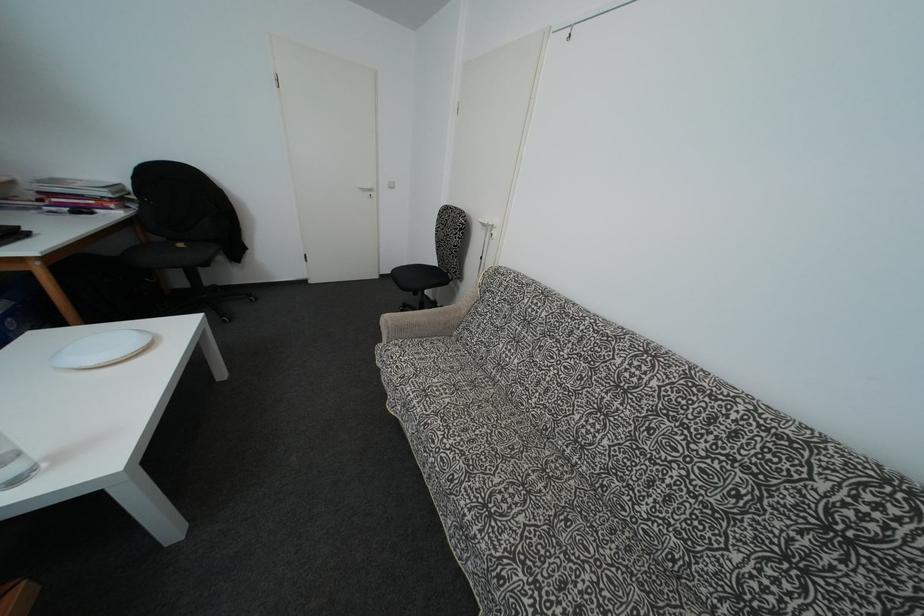
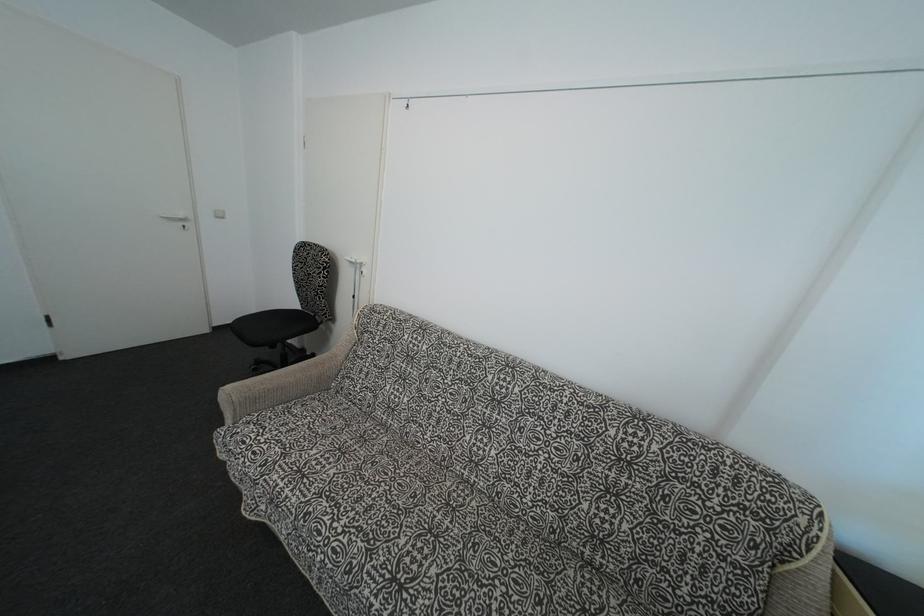
In the second image, find the point that corresponds to (x=481, y=505) in the first image.

(387, 583)